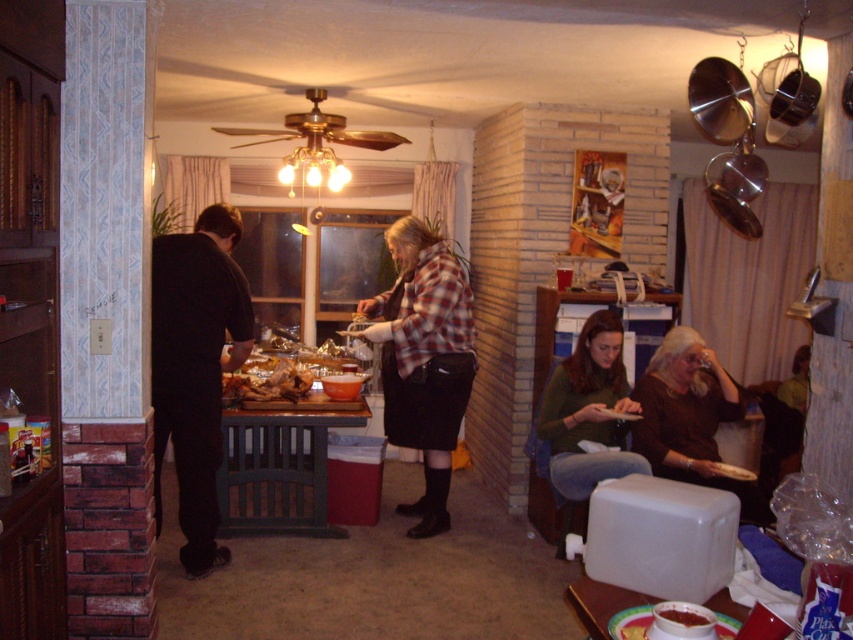
You are standing in the dining area and notice the plaid fabric shirt at center. Can you determine its exact position using the coordinate system provided?

The plaid fabric shirt at center is located at point (422, 358) according to the coordinate system provided.

You are standing in the dining area and want to move from point A to point B. Point A is at coordinates point (454, 369) and point B is at coordinates point (268, 380). Which point is closer to you when you are facing the table?

Point (454, 369) is in front of point (268, 380), so when facing the table, point A is closer to you than point B.

You are a guest at this dinner party and need to choose a coat rack to hang your coat. The coat rack must be tall enough to accommodate both the black matte suit at left and the green sweater at lower right. Which object should you use based on their heights?

The black matte suit at left is taller than the green sweater at lower right, so you should choose a coat rack that can accommodate the height of the black matte suit at left.